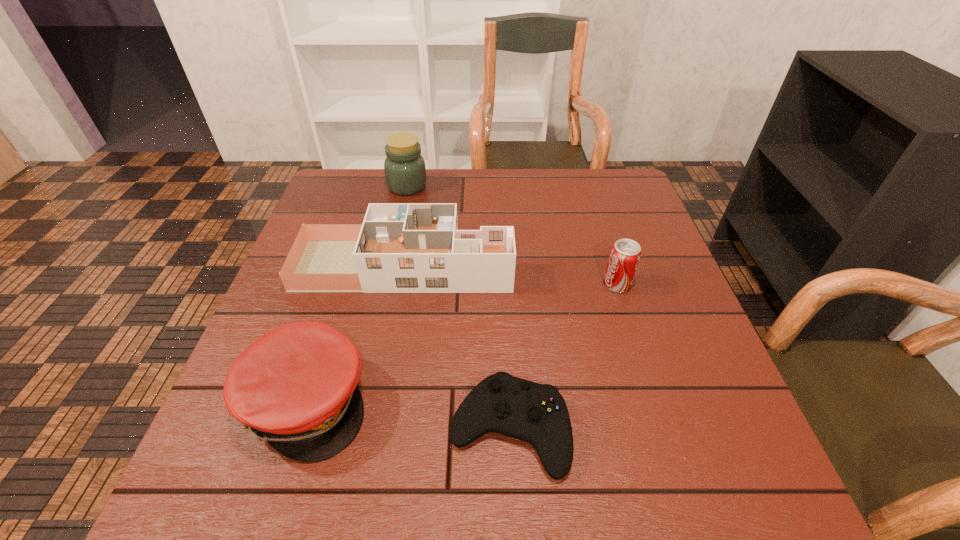
At what (x,y) coordinates should I click in order to perform the action: click on the tallest object. Please return your answer as a coordinate pair (x, y). Looking at the image, I should click on (405, 171).

Locate an element on the screen. This screenshot has height=540, width=960. the farthest object is located at coordinates (405, 171).

This screenshot has height=540, width=960. I want to click on dollhouse, so click(401, 247).

I want to click on the rightmost object, so click(625, 254).

At what (x,y) coordinates should I click in order to perform the action: click on cap. Please return your answer as a coordinate pair (x, y). This screenshot has width=960, height=540. Looking at the image, I should click on (295, 387).

The width and height of the screenshot is (960, 540). I want to click on the shortest object, so click(535, 413).

This screenshot has height=540, width=960. Identify the location of free point located 0.180m on the right of the jar. (488, 186).

The image size is (960, 540). What are the coordinates of `free space located at the entrance of the dollhouse` in the screenshot? It's located at (618, 265).

I want to click on vacant area located 0.190m on the left of the rightmost object, so click(x=521, y=284).

The width and height of the screenshot is (960, 540). In order to click on vacant area located 0.360m at the front of the cap where the visor is located in this screenshot , I will do `click(565, 402)`.